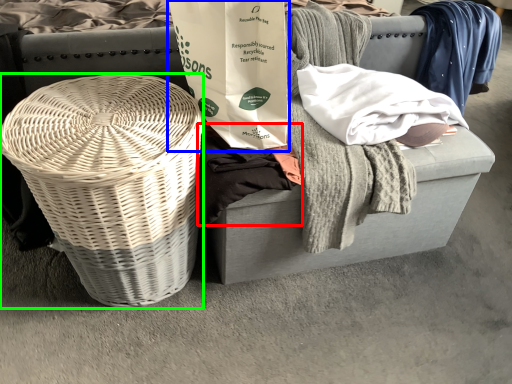
Question: Which is nearer to the clothing (highlighted by a red box)? shopping bag (highlighted by a blue box) or basket (highlighted by a green box).

Choices:
 (A) shopping bag
 (B) basket

Answer: (A)